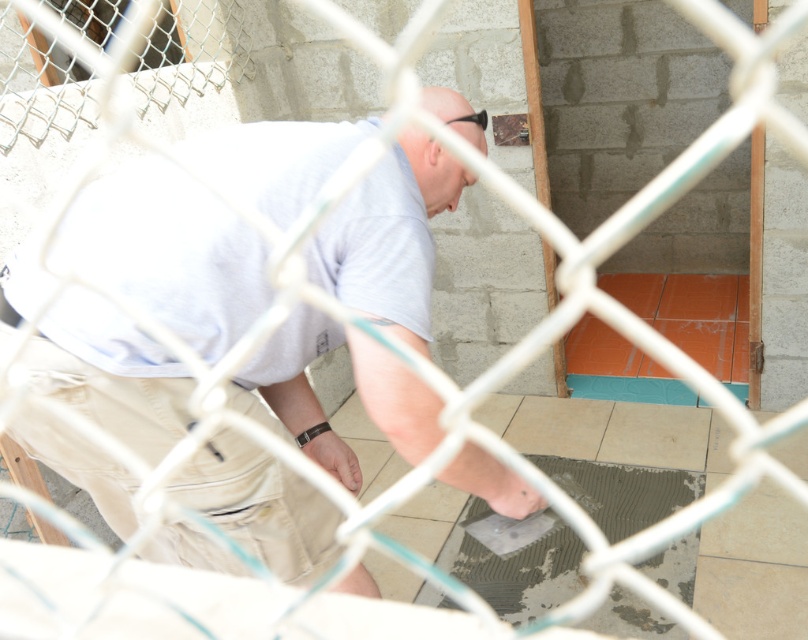
Question: Among these objects, which one is farthest from the camera?

Choices:
 (A) beige ceramic tile at center
 (B) light gray shirt at center

Answer: (A)

Question: Among these points, which one is farthest from the camera?

Choices:
 (A) (608, 452)
 (B) (85, 234)

Answer: (A)

Question: Is light gray shirt at center smaller than beige ceramic tile at center?

Choices:
 (A) no
 (B) yes

Answer: (A)

Question: Does light gray shirt at center have a smaller size compared to beige ceramic tile at center?

Choices:
 (A) yes
 (B) no

Answer: (B)

Question: Is light gray shirt at center to the right of beige ceramic tile at center from the viewer's perspective?

Choices:
 (A) yes
 (B) no

Answer: (B)